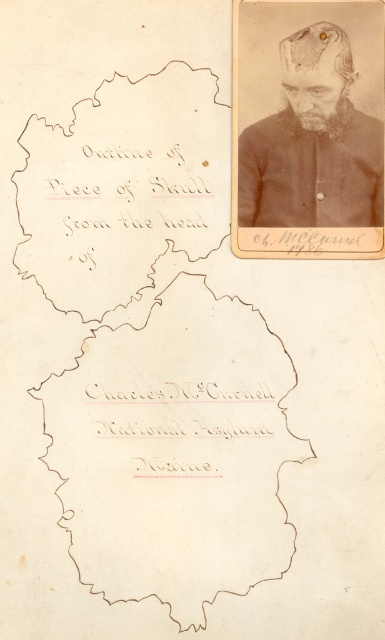
Question: Where is brown paper map at center located in relation to dark brown hair at upper right in the image?

Choices:
 (A) above
 (B) below

Answer: (B)

Question: Is the position of brown paper map at center more distant than that of dark brown hair at upper right?

Choices:
 (A) yes
 (B) no

Answer: (A)

Question: Which of the following is the closest to the observer?

Choices:
 (A) dark brown hair at upper right
 (B) brown paper map at center

Answer: (A)

Question: Among these objects, which one is nearest to the camera?

Choices:
 (A) dark brown hair at upper right
 (B) brown paper map at center

Answer: (A)

Question: Is brown paper map at center closer to the viewer compared to dark brown hair at upper right?

Choices:
 (A) no
 (B) yes

Answer: (A)